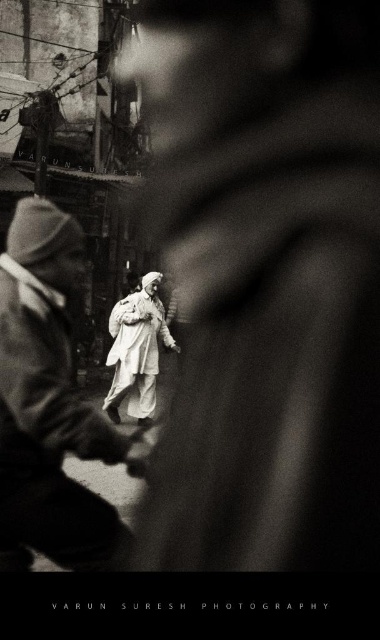
Find the location of a particular element. Image resolution: width=380 pixels, height=640 pixels. matte gray coat at center is located at coordinates (50, 403).

Is point (50, 492) positioned in front of point (142, 412)?

Yes, point (50, 492) is in front of point (142, 412).

Is point (19, 544) in front of point (144, 365)?

Yes, point (19, 544) is in front of point (144, 365).

Where is `matte gray coat at center`? The width and height of the screenshot is (380, 640). matte gray coat at center is located at coordinates (50, 403).